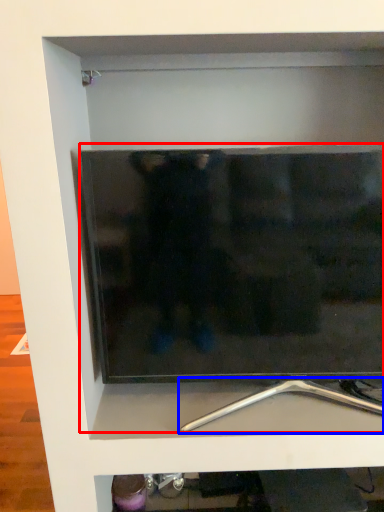
Question: Which of the following is the farthest to the observer, television (highlighted by a red box) or silver (highlighted by a blue box)?

Choices:
 (A) television
 (B) silver

Answer: (B)